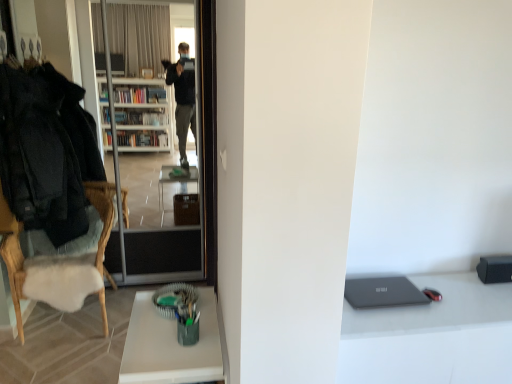
Question: Is green matte cup at lower center taller than black woolen jacket at left?

Choices:
 (A) yes
 (B) no

Answer: (B)

Question: From a real-world perspective, is green matte cup at lower center positioned over black woolen jacket at left based on gravity?

Choices:
 (A) no
 (B) yes

Answer: (A)

Question: Is green matte cup at lower center to the left of black woolen jacket at left from the viewer's perspective?

Choices:
 (A) no
 (B) yes

Answer: (A)

Question: Considering the relative positions of green matte cup at lower center and black woolen jacket at left in the image provided, is green matte cup at lower center in front of black woolen jacket at left?

Choices:
 (A) yes
 (B) no

Answer: (A)

Question: From a real-world perspective, is green matte cup at lower center located beneath black woolen jacket at left?

Choices:
 (A) no
 (B) yes

Answer: (B)

Question: Does point (160, 342) appear closer or farther from the camera than point (373, 289)?

Choices:
 (A) closer
 (B) farther

Answer: (A)

Question: Is green matte cup at lower center in front of or behind matte gray laptop at lower right in the image?

Choices:
 (A) front
 (B) behind

Answer: (A)

Question: In terms of size, does green matte cup at lower center appear bigger or smaller than matte gray laptop at lower right?

Choices:
 (A) big
 (B) small

Answer: (A)

Question: From a real-world perspective, relative to matte gray laptop at lower right, is green matte cup at lower center vertically above or below?

Choices:
 (A) below
 (B) above

Answer: (A)

Question: Considering the positions of point (410, 299) and point (54, 291), is point (410, 299) closer or farther from the camera than point (54, 291)?

Choices:
 (A) closer
 (B) farther

Answer: (A)

Question: Is matte gray laptop at lower right taller or shorter than white sheepskin cushion at left?

Choices:
 (A) tall
 (B) short

Answer: (B)

Question: From the image's perspective, is matte gray laptop at lower right above or below white sheepskin cushion at left?

Choices:
 (A) above
 (B) below

Answer: (B)

Question: From a real-world perspective, relative to white sheepskin cushion at left, is matte gray laptop at lower right vertically above or below?

Choices:
 (A) above
 (B) below

Answer: (A)

Question: Is black woolen jacket at left to the left or to the right of green matte cup at lower center in the image?

Choices:
 (A) right
 (B) left

Answer: (B)

Question: Looking at the image, does black woolen jacket at left seem bigger or smaller compared to green matte cup at lower center?

Choices:
 (A) small
 (B) big

Answer: (B)